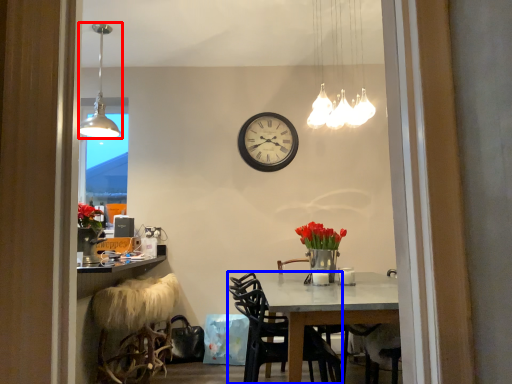
Question: Which point is closer to the camera, lamp (highlighted by a red box) or chair (highlighted by a blue box)?

Choices:
 (A) lamp
 (B) chair

Answer: (B)